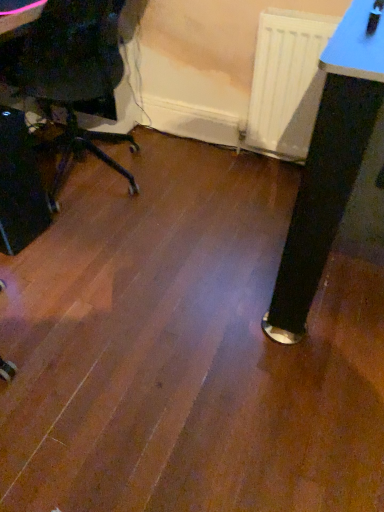
Find the location of a particular element. The height and width of the screenshot is (512, 384). vacant region to the left of white matte radiator at center is located at coordinates (221, 170).